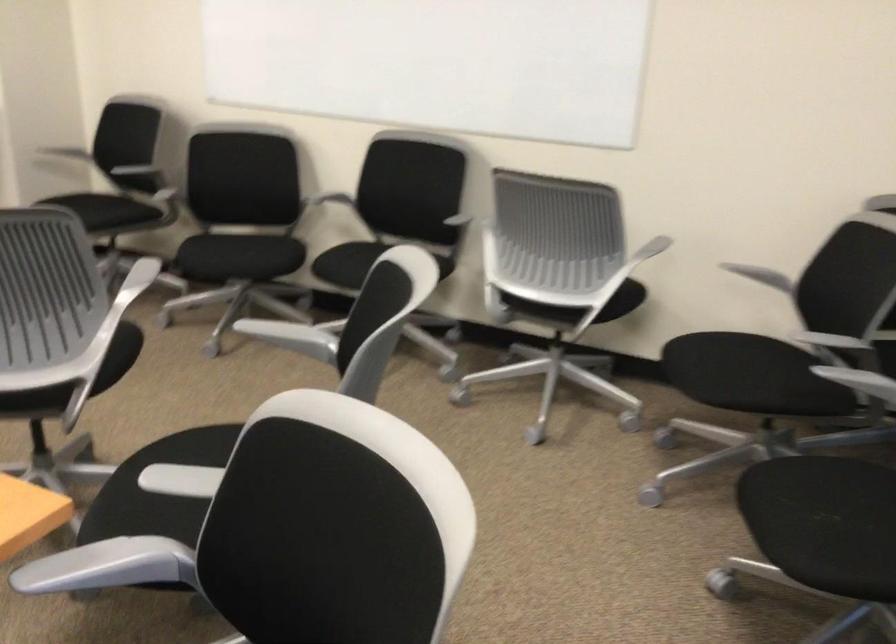
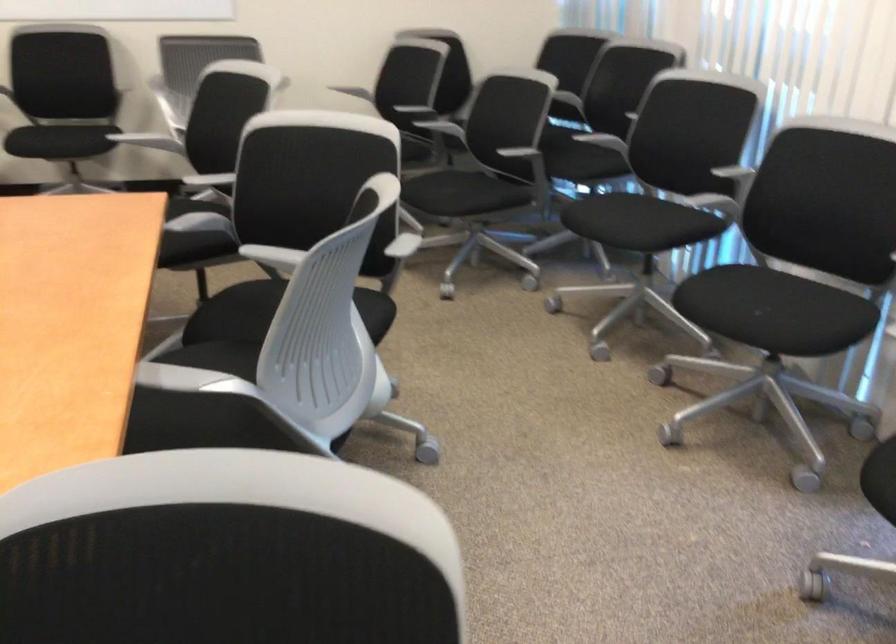
Question: I am providing you with two images of the same scene from different viewpoints. Which of the following objects are not visible in image2?

Choices:
 (A) metal stall lock
 (B) chair sitting surface
 (C) white chair armrest
 (D) black chair sitting surface

Answer: (D)